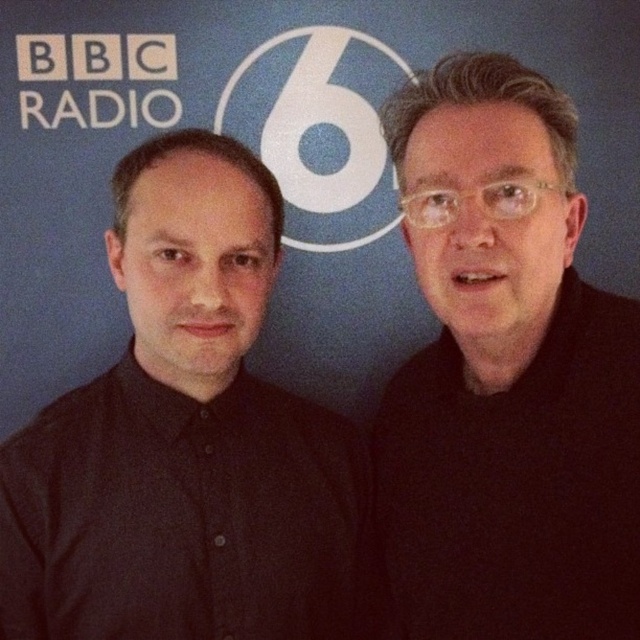
Question: Which point is farther to the camera?

Choices:
 (A) black matte shirt at right
 (B) black button-up shirt at left

Answer: (B)

Question: Can you confirm if black matte shirt at right is positioned below black button-up shirt at left?

Choices:
 (A) no
 (B) yes

Answer: (A)

Question: Is the position of black matte shirt at right more distant than that of black button-up shirt at left?

Choices:
 (A) yes
 (B) no

Answer: (B)

Question: Is black matte shirt at right smaller than black button-up shirt at left?

Choices:
 (A) yes
 (B) no

Answer: (B)

Question: Among these objects, which one is farthest from the camera?

Choices:
 (A) black matte shirt at right
 (B) black button-up shirt at left

Answer: (B)

Question: Which point appears farthest from the camera in this image?

Choices:
 (A) [x=486, y=337]
 (B) [x=227, y=524]

Answer: (B)